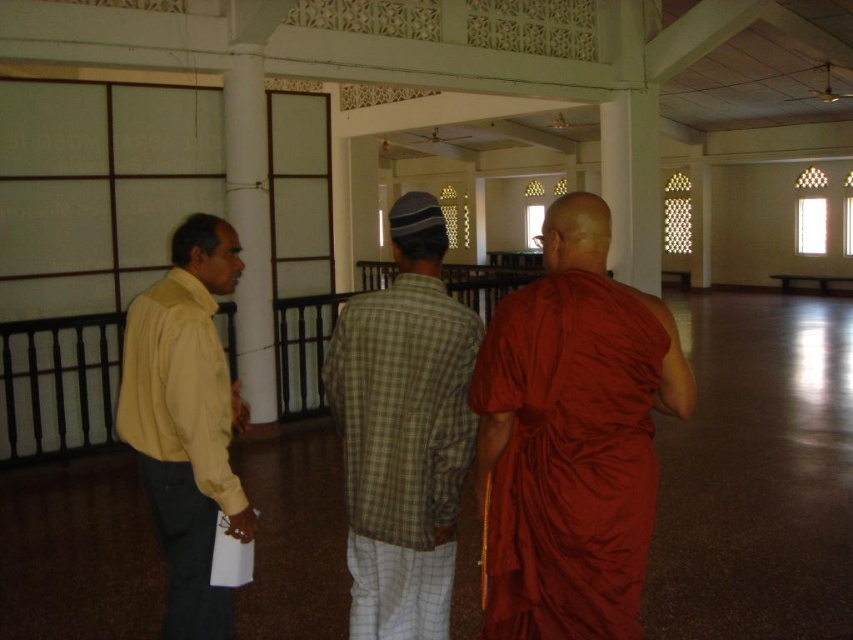
You are standing at the entrance of the hall and want to approach the matte orange robe at right. Based on its position, which direction should you move relative to the entrance?

The matte orange robe at right is located at point (569, 458), so you should move towards the right side of the hall to reach it.

You are a photographer setting up a camera at the back of the hall. You need to ensure that both the matte orange robe at right and the yellow matte shirt at left are fully visible in your shot. Given their heights, which one might require you to adjust your camera angle to avoid being blocked by the other?

The matte orange robe at right is shorter than the yellow matte shirt at left. Therefore, you might need to lower the camera angle to ensure the shorter matte orange robe at right isn not blocked by the taller yellow matte shirt at left.

You are standing in the hall and want to hand a small gift to the person wearing the yellow matte shirt at left. The gift is too big to throw. Which direction should you move to reach them without passing through the matte orange robe at right?

You should move to the left because the matte orange robe at right is closer to you than the yellow matte shirt at left, so moving left will avoid the robe and reach the shirt wearer.